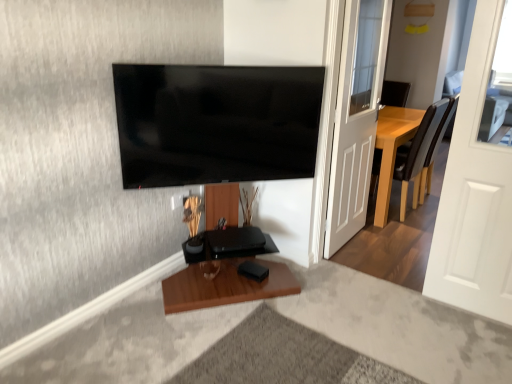
Question: Is white matte door at right, arranged as the first door when viewed from the front, further to camera compared to flat screen tv at upper center?

Choices:
 (A) no
 (B) yes

Answer: (A)

Question: Would you say white matte door at right, placed as the second door when sorted from left to right, contains flat screen tv at upper center?

Choices:
 (A) yes
 (B) no

Answer: (B)

Question: Is white matte door at right, the 1th door from the right, aimed at flat screen tv at upper center?

Choices:
 (A) yes
 (B) no

Answer: (B)

Question: Can you confirm if white matte door at right, placed as the second door when sorted from left to right, is positioned to the left of flat screen tv at upper center?

Choices:
 (A) yes
 (B) no

Answer: (B)

Question: Is white matte door at right, arranged as the first door when viewed from the front, closer to camera compared to flat screen tv at upper center?

Choices:
 (A) no
 (B) yes

Answer: (B)

Question: Is white glossy door at right, the 2th door from the right, wider or thinner than flat screen tv at upper center?

Choices:
 (A) wide
 (B) thin

Answer: (B)

Question: Considering the positions of white glossy door at right, which is the first door from left to right, and flat screen tv at upper center in the image, is white glossy door at right, which is the first door from left to right, bigger or smaller than flat screen tv at upper center?

Choices:
 (A) big
 (B) small

Answer: (A)

Question: Would you say white glossy door at right, which is counted as the first door, starting from the back, is to the left or to the right of flat screen tv at upper center in the picture?

Choices:
 (A) right
 (B) left

Answer: (A)

Question: Considering their positions, is white glossy door at right, which is counted as the first door, starting from the back, located in front of or behind flat screen tv at upper center?

Choices:
 (A) front
 (B) behind

Answer: (B)

Question: In terms of height, does white matte door at right, which is the second door from back to front, look taller or shorter compared to brown leather chair at right?

Choices:
 (A) tall
 (B) short

Answer: (A)

Question: From a real-world perspective, is white matte door at right, which is the second door from back to front, above or below brown leather chair at right?

Choices:
 (A) above
 (B) below

Answer: (A)

Question: Is white matte door at right, which is the second door from back to front, spatially inside brown leather chair at right, or outside of it?

Choices:
 (A) outside
 (B) inside

Answer: (A)

Question: From the image's perspective, relative to brown leather chair at right, is white matte door at right, arranged as the first door when viewed from the front, above or below?

Choices:
 (A) below
 (B) above

Answer: (A)

Question: Based on their sizes in the image, would you say white matte door at right, placed as the second door when sorted from left to right, is bigger or smaller than white glossy door at right, the 2th door from the right?

Choices:
 (A) big
 (B) small

Answer: (B)

Question: In the image, is white matte door at right, placed as the second door when sorted from left to right, positioned in front of or behind white glossy door at right, which is the first door from left to right?

Choices:
 (A) behind
 (B) front

Answer: (B)